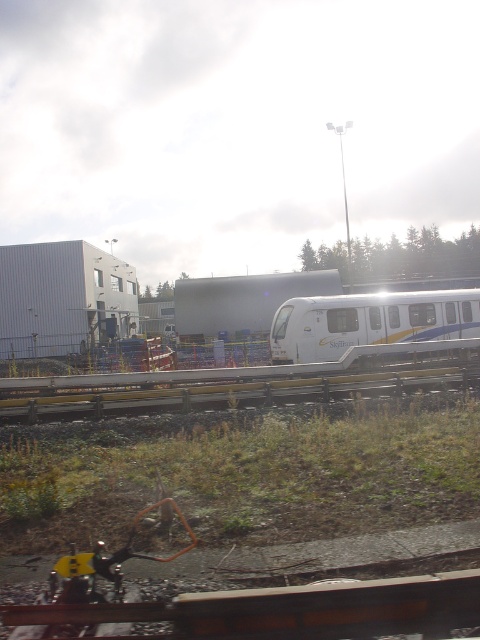
Can you confirm if yellow metallic rail at center is positioned to the right of white glossy passenger train at center?

In fact, yellow metallic rail at center is to the left of white glossy passenger train at center.

Who is higher up, yellow metallic rail at center or white glossy passenger train at center?

white glossy passenger train at center

What do you see at coordinates (238, 387) in the screenshot?
I see `yellow metallic rail at center` at bounding box center [238, 387].

Locate an element on the screen. This screenshot has height=640, width=480. yellow metallic rail at center is located at coordinates (238, 387).